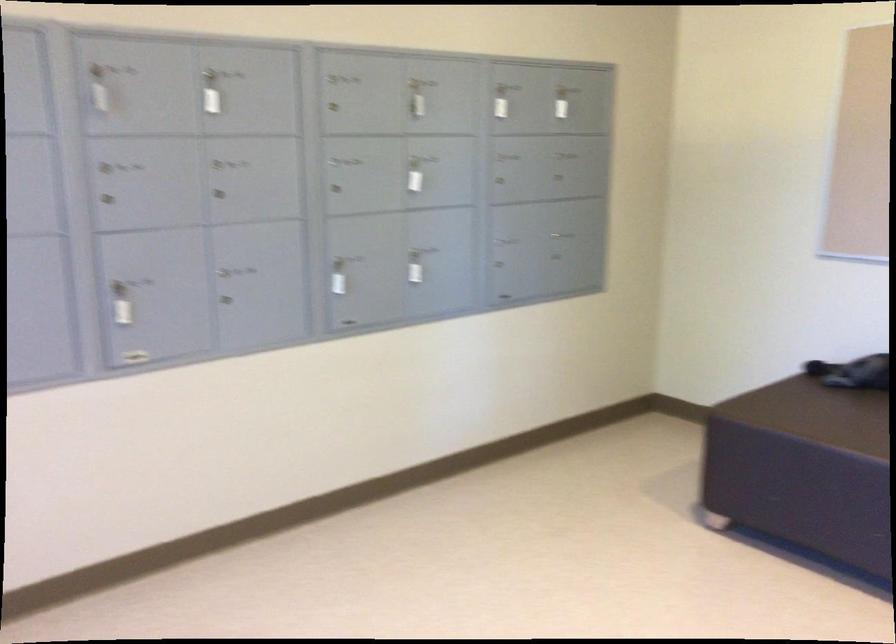
Question: The first image is from the beginning of the video and the second image is from the end. How did the camera likely rotate when shooting the video?

Choices:
 (A) Left
 (B) Right
 (C) Up
 (D) Down

Answer: (B)